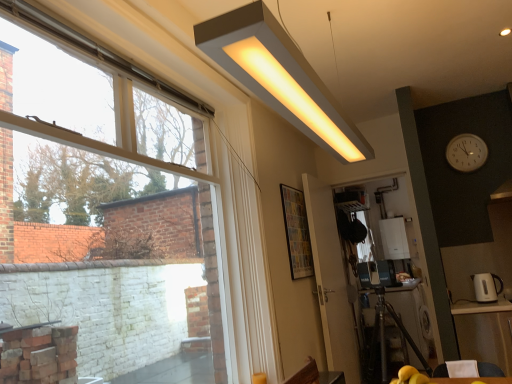
Question: Is white glossy electric kettle at right, placed as the second appliance when sorted from right to left, shorter than transparent plastic screen door at center, the second screen door from the right?

Choices:
 (A) no
 (B) yes

Answer: (B)

Question: Is the surface of white glossy electric kettle at right, which is the 1th appliance from front to back, in direct contact with transparent plastic screen door at center, the first screen door positioned from the left?

Choices:
 (A) no
 (B) yes

Answer: (A)

Question: From the image's perspective, does white glossy electric kettle at right, which is the second appliance from back to front, appear higher than transparent plastic screen door at center, the first screen door positioned from the left?

Choices:
 (A) yes
 (B) no

Answer: (A)

Question: Considering the relative positions of white glossy electric kettle at right, placed as the second appliance when sorted from right to left, and transparent plastic screen door at center, the first screen door positioned from the left, in the image provided, is white glossy electric kettle at right, placed as the second appliance when sorted from right to left, to the left of transparent plastic screen door at center, the first screen door positioned from the left, from the viewer's perspective?

Choices:
 (A) yes
 (B) no

Answer: (B)

Question: Considering the relative sizes of white glossy electric kettle at right, which is the 1th appliance from front to back, and transparent plastic screen door at center, the first screen door positioned from the left, in the image provided, is white glossy electric kettle at right, which is the 1th appliance from front to back, taller than transparent plastic screen door at center, the first screen door positioned from the left,?

Choices:
 (A) no
 (B) yes

Answer: (A)

Question: Is white glossy electric kettle at right, which is the 1th appliance from front to back, outside transparent plastic screen door at center, the first screen door positioned from the left?

Choices:
 (A) yes
 (B) no

Answer: (A)

Question: Could you tell me if transparent plastic screen door at center, the first screen door positioned from the left, is facing wooden table at lower right, the first table in the back-to-front sequence?

Choices:
 (A) no
 (B) yes

Answer: (A)

Question: Can you confirm if transparent plastic screen door at center, the second screen door from the right, is positioned to the right of wooden table at lower right, the first table in the back-to-front sequence?

Choices:
 (A) yes
 (B) no

Answer: (B)

Question: Can you confirm if transparent plastic screen door at center, the first screen door positioned from the left, is shorter than wooden table at lower right, the first table in the back-to-front sequence?

Choices:
 (A) yes
 (B) no

Answer: (B)

Question: Is transparent plastic screen door at center, the second screen door from the right, looking in the opposite direction of wooden table at lower right, the first table in the back-to-front sequence?

Choices:
 (A) no
 (B) yes

Answer: (A)

Question: From a real-world perspective, is transparent plastic screen door at center, the first screen door positioned from the left, under wooden table at lower right, acting as the 2th table starting from the front?

Choices:
 (A) no
 (B) yes

Answer: (A)

Question: Does transparent plastic screen door at center, the second screen door from the right, come behind wooden table at lower right, acting as the 2th table starting from the front?

Choices:
 (A) no
 (B) yes

Answer: (A)

Question: Considering the relative sizes of white plastic clock at upper right and transparent glass window at upper left in the image provided, is white plastic clock at upper right thinner than transparent glass window at upper left?

Choices:
 (A) yes
 (B) no

Answer: (A)